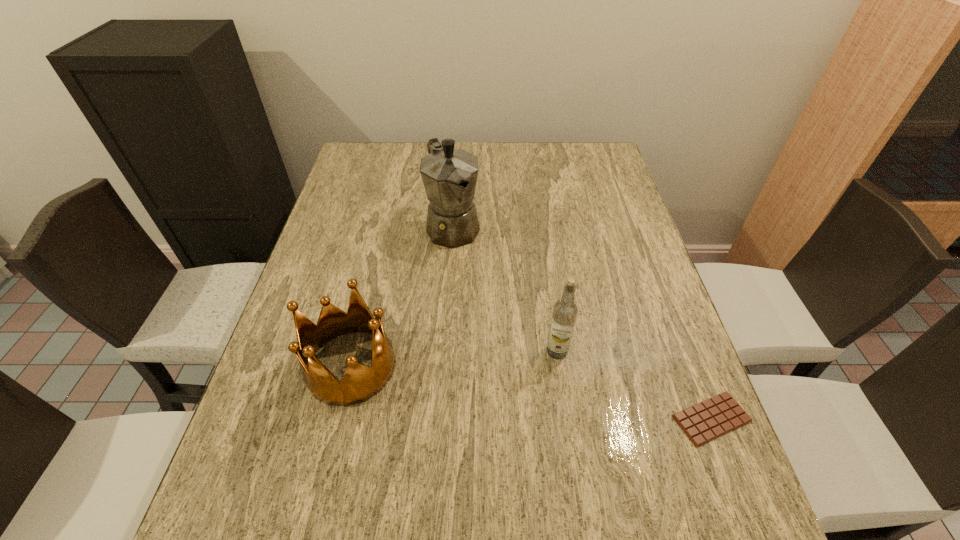
Where is `free space at the far edge of the desktop`? free space at the far edge of the desktop is located at coordinates (527, 168).

In the image, there is a desktop. What are the coordinates of `vacant space at the near edge` in the screenshot? It's located at (440, 440).

This screenshot has height=540, width=960. In the image, there is a desktop. In order to click on free space at the left edge in this screenshot , I will do `click(256, 406)`.

Identify the location of free space at the right edge of the desktop. This screenshot has height=540, width=960. (638, 274).

In the image, there is a desktop. At what (x,y) coordinates should I click in order to perform the action: click on vacant space at the far left corner. Please return your answer as a coordinate pair (x, y). Looking at the image, I should click on (398, 145).

At what (x,y) coordinates should I click in order to perform the action: click on free space at the far right corner of the desktop. Please return your answer as a coordinate pair (x, y). The image size is (960, 540). Looking at the image, I should click on (597, 177).

The image size is (960, 540). I want to click on vacant area between the crown and the rightmost object, so click(531, 392).

Image resolution: width=960 pixels, height=540 pixels. I want to click on free space between the tallest object and the second tallest object, so click(505, 289).

In order to click on free spot between the third object from left to right and the leftmost object in this screenshot , I will do `click(454, 359)`.

Where is `free space between the third object from left to right and the crown`? This screenshot has height=540, width=960. free space between the third object from left to right and the crown is located at coordinates (454, 359).